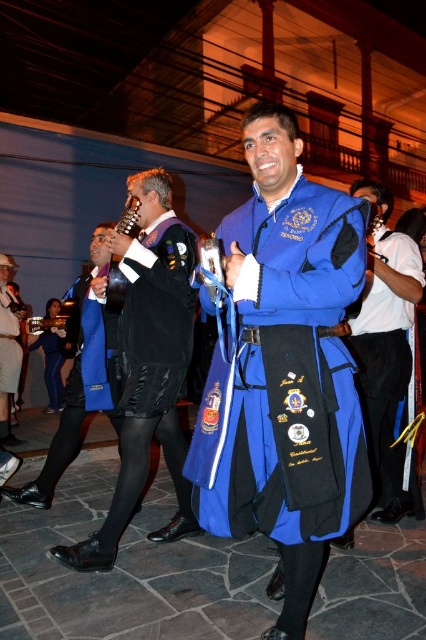
Can you confirm if blue satin sash at center is shorter than metallic gold trumpet at center?

In fact, blue satin sash at center may be taller than metallic gold trumpet at center.

Is the position of blue satin sash at center less distant than that of metallic gold trumpet at center?

Yes, blue satin sash at center is in front of metallic gold trumpet at center.

Does point (380, 300) come behind point (117, 268)?

Yes, point (380, 300) is farther from viewer.

Where is `blue satin sash at center`? The height and width of the screenshot is (640, 426). blue satin sash at center is located at coordinates (385, 349).

Between point (155, 339) and point (118, 284), which one is positioned in front?

Point (155, 339) is in front.

Is blue velvet robe at center below metallic gold trumpet at center?

Yes, blue velvet robe at center is below metallic gold trumpet at center.

Where is `blue velvet robe at center`? This screenshot has width=426, height=640. blue velvet robe at center is located at coordinates (147, 365).

This screenshot has width=426, height=640. Identify the location of blue velvet robe at center. (147, 365).

Does blue velvet robe at center lie in front of black leather shoes at lower left?

Yes, it is.

Does blue velvet robe at center have a smaller size compared to black leather shoes at lower left?

Indeed, blue velvet robe at center has a smaller size compared to black leather shoes at lower left.

Is point (175, 472) positioned behind point (104, 316)?

No, it is in front of (104, 316).

This screenshot has height=640, width=426. I want to click on blue velvet robe at center, so click(147, 365).